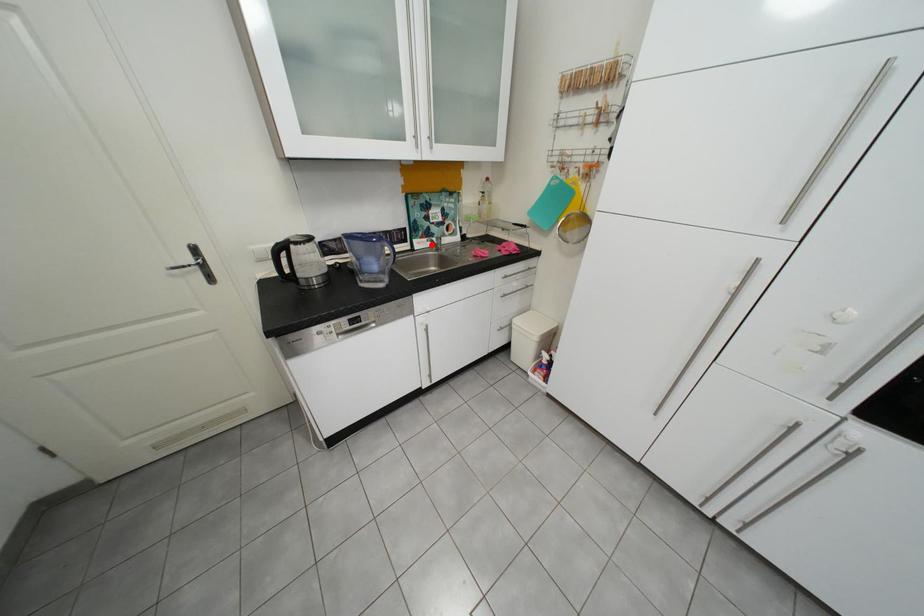
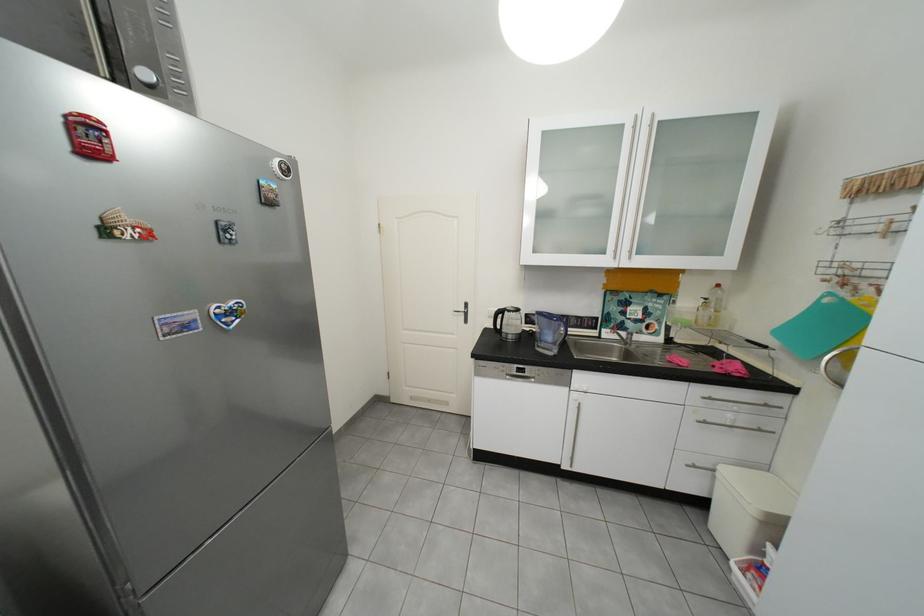
Question: A red point is marked in image1. In image2, is the corresponding 3D point closer to the camera or farther? Reply with the corresponding letter.

Choices:
 (A) The corresponding 3D point is closer.
 (B) The corresponding 3D point is farther.

Answer: (B)